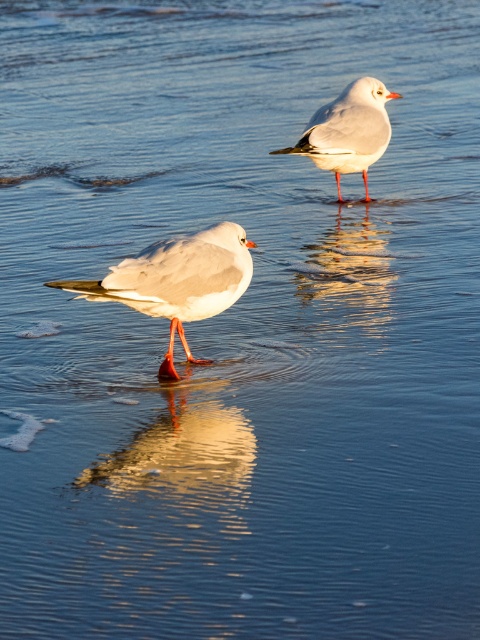
Does white matte seagull at center have a lesser width compared to white matte bird at upper center?

No, white matte seagull at center is not thinner than white matte bird at upper center.

Between white matte seagull at center and white matte bird at upper center, which one appears on the left side from the viewer's perspective?

white matte seagull at center

Between point (211, 250) and point (372, 100), which one is positioned behind?

Point (372, 100)

The image size is (480, 640). In order to click on white matte seagull at center in this screenshot , I will do `click(178, 280)`.